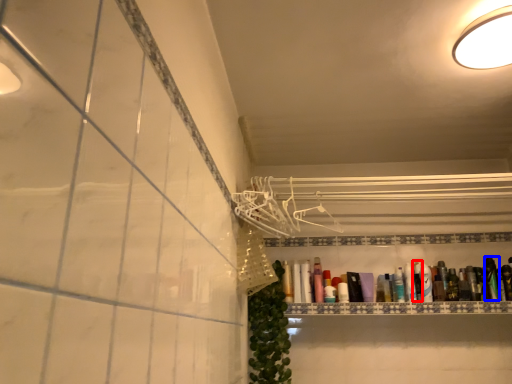
Question: Which object appears closest to the camera in this image, toiletry (highlighted by a red box) or toiletry (highlighted by a blue box)?

Choices:
 (A) toiletry
 (B) toiletry

Answer: (B)